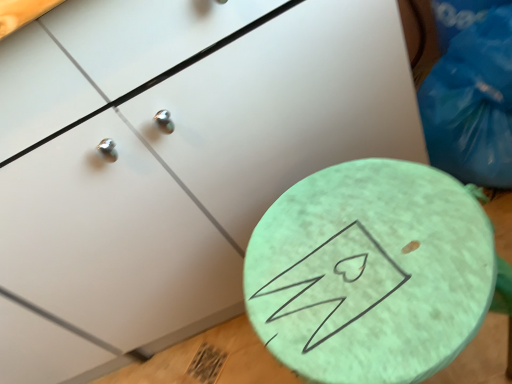
Question: Is mint green textured table at center bigger or smaller than blue plastic bag at upper right?

Choices:
 (A) small
 (B) big

Answer: (B)

Question: From the image's perspective, is mint green textured table at center located above or below blue plastic bag at upper right?

Choices:
 (A) below
 (B) above

Answer: (A)

Question: In terms of height, does mint green textured table at center look taller or shorter compared to blue plastic bag at upper right?

Choices:
 (A) short
 (B) tall

Answer: (B)

Question: From a real-world perspective, is blue plastic bag at upper right above or below mint green textured table at center?

Choices:
 (A) above
 (B) below

Answer: (A)

Question: Considering the positions of point (477, 155) and point (270, 279), is point (477, 155) closer or farther from the camera than point (270, 279)?

Choices:
 (A) farther
 (B) closer

Answer: (A)

Question: In the image, is blue plastic bag at upper right positioned in front of or behind mint green textured table at center?

Choices:
 (A) behind
 (B) front

Answer: (A)

Question: From the image's perspective, is blue plastic bag at upper right above or below mint green textured table at center?

Choices:
 (A) below
 (B) above

Answer: (B)